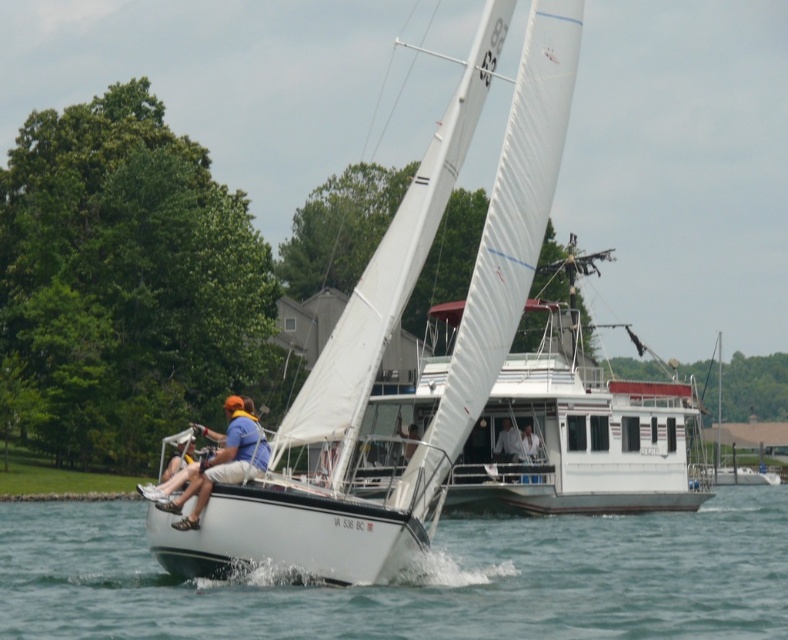
You are a photographer trying to capture the scene of the sailboat. You want to know if the white smooth water at center will occupy more space in the photo than the white fabric shirt at center. Based on the description, what can you conclude?

The white smooth water at center has a larger width than the white fabric shirt at center, so it will occupy more space in the photo.